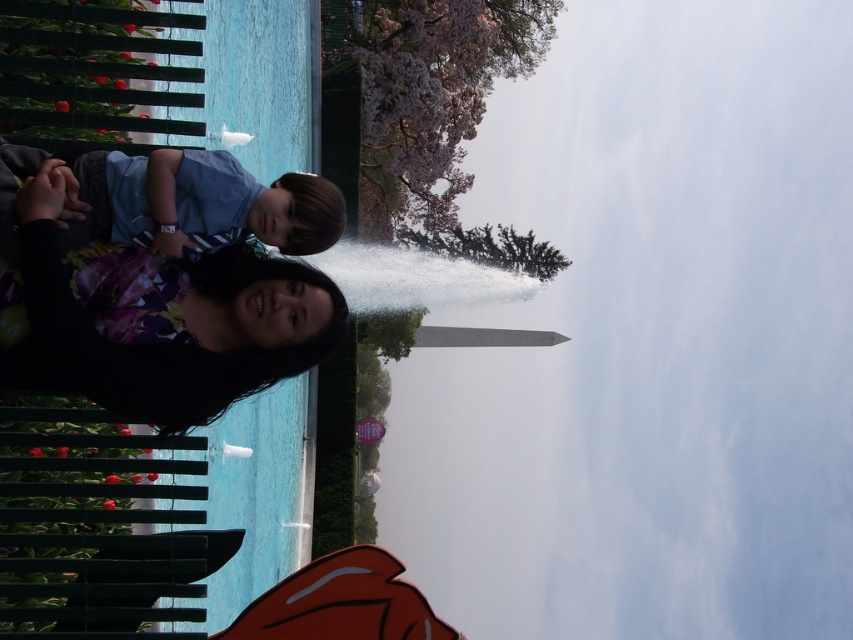
Does clear blue water at center have a lesser height compared to black floral dress at lower left?

No.

Is clear blue water at center further to the viewer compared to black floral dress at lower left?

Yes, clear blue water at center is further from the viewer.

Which is in front, point (570, 164) or point (169, 372)?

Point (169, 372) is more forward.

Locate an element on the screen. This screenshot has height=640, width=853. clear blue water at center is located at coordinates (650, 340).

Does point (663, 344) lie behind point (109, 236)?

Yes, point (663, 344) is farther from viewer.

Is clear blue water at center above blue striped shirt at left?

Incorrect, clear blue water at center is not positioned above blue striped shirt at left.

Does point (740, 472) come in front of point (277, 244)?

No, it is not.

Locate an element on the screen. This screenshot has height=640, width=853. clear blue water at center is located at coordinates (650, 340).

Who is higher up, black floral dress at lower left or blue striped shirt at left?

blue striped shirt at left

Between black floral dress at lower left and blue striped shirt at left, which one appears on the left side from the viewer's perspective?

blue striped shirt at left is more to the left.

Which is behind, point (25, 388) or point (335, 186)?

Positioned behind is point (335, 186).

Where is `black floral dress at lower left`? black floral dress at lower left is located at coordinates (151, 310).